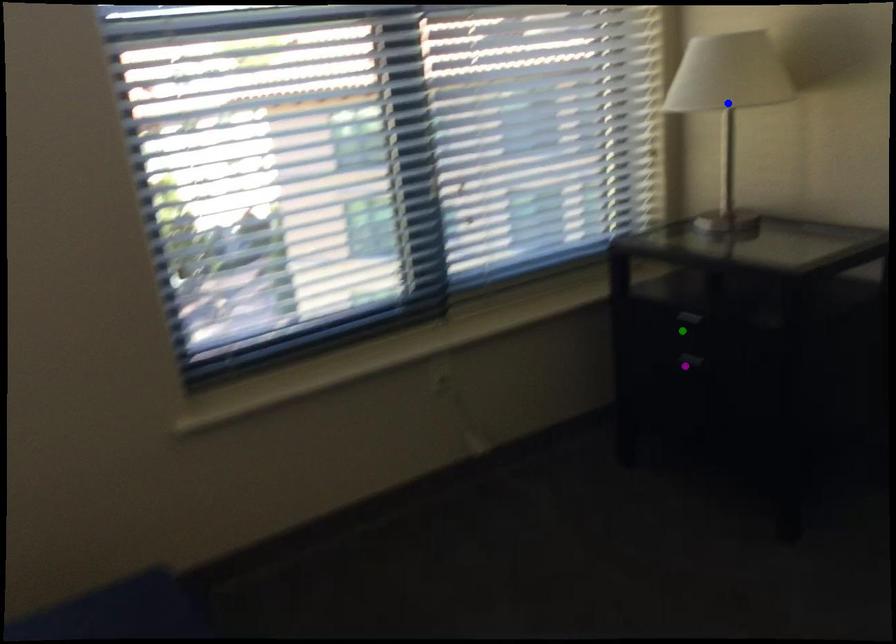
Order these from nearest to farthest:
purple point, blue point, green point

blue point < purple point < green point